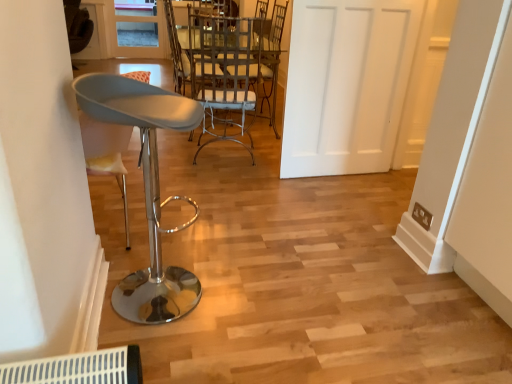
Locate an element on the screen. The image size is (512, 384). white matte door at center is located at coordinates (346, 84).

Locate an element on the screen. Image resolution: width=512 pixels, height=384 pixels. white matte door at center is located at coordinates (346, 84).

Between point (400, 114) and point (139, 317), which one is positioned in front?

The point (139, 317) is closer.

Is white matte door at center oriented away from matte gray stool at left, marked as the 2th chair in a back-to-front arrangement?

white matte door at center does not have its back to matte gray stool at left, marked as the 2th chair in a back-to-front arrangement.

Considering the relative positions of white matte door at center and matte gray stool at left, which appears as the first chair when viewed from the front, in the image provided, is white matte door at center to the left or to the right of matte gray stool at left, which appears as the first chair when viewed from the front,?

In the image, white matte door at center appears on the right side of matte gray stool at left, which appears as the first chair when viewed from the front.

Which object is more forward, white matte door at center or matte gray stool at left, marked as the 2th chair in a back-to-front arrangement?

Positioned in front is matte gray stool at left, marked as the 2th chair in a back-to-front arrangement.

I want to click on door in front of the clear glass door at upper center, so click(346, 84).

Consider the image. Considering the sizes of objects clear glass door at upper center and white matte door at center in the image provided, who is wider, clear glass door at upper center or white matte door at center?

white matte door at center.

Considering the relative positions of clear glass door at upper center and white matte door at center in the image provided, is clear glass door at upper center to the left of white matte door at center from the viewer's perspective?

Indeed, clear glass door at upper center is positioned on the left side of white matte door at center.

Based on the photo, does clear glass door at upper center have a lesser height compared to white matte door at center?

Correct, clear glass door at upper center is not as tall as white matte door at center.

From a real-world perspective, who is located higher, white fabric chair at center, the second chair from the front, or clear glass door at upper center?

From a 3D spatial view, white fabric chair at center, the second chair from the front, is above.

Can you tell me how much white fabric chair at center, the second chair from the front, and clear glass door at upper center differ in facing direction?

The facing directions of white fabric chair at center, the second chair from the front, and clear glass door at upper center are 104 degrees apart.

Is white fabric chair at center, the second chair from the front, facing away from clear glass door at upper center?

Answer: No.

Which point is more forward, (205, 40) or (130, 27)?

The point (205, 40) is in front.

From the image's perspective, is white fabric chair at center, which is the 1th chair in back-to-front order, over matte gray stool at left, which appears as the first chair when viewed from the front?

Indeed, from the image's perspective, white fabric chair at center, which is the 1th chair in back-to-front order, is shown above matte gray stool at left, which appears as the first chair when viewed from the front.

Is white fabric chair at center, which is the 1th chair in back-to-front order, taller or shorter than matte gray stool at left, marked as the 2th chair in a back-to-front arrangement?

Clearly, white fabric chair at center, which is the 1th chair in back-to-front order, is taller compared to matte gray stool at left, marked as the 2th chair in a back-to-front arrangement.

Is matte gray stool at left, marked as the 2th chair in a back-to-front arrangement, a part of white fabric chair at center, the second chair from the front?

Actually, matte gray stool at left, marked as the 2th chair in a back-to-front arrangement, is outside white fabric chair at center, the second chair from the front.

Considering the sizes of objects white fabric chair at center, the second chair from the front, and matte gray stool at left, marked as the 2th chair in a back-to-front arrangement, in the image provided, who is thinner, white fabric chair at center, the second chair from the front, or matte gray stool at left, marked as the 2th chair in a back-to-front arrangement,?

matte gray stool at left, marked as the 2th chair in a back-to-front arrangement, is thinner.

From a real-world perspective, is matte gray stool at left, which appears as the first chair when viewed from the front, under clear glass door at upper center?

Actually, matte gray stool at left, which appears as the first chair when viewed from the front, is physically above clear glass door at upper center in the real world.

Which of these two, matte gray stool at left, which appears as the first chair when viewed from the front, or clear glass door at upper center, is thinner?

clear glass door at upper center.

Is matte gray stool at left, which appears as the first chair when viewed from the front, inside or outside of clear glass door at upper center?

matte gray stool at left, which appears as the first chair when viewed from the front, lies outside clear glass door at upper center.

Is matte gray stool at left, marked as the 2th chair in a back-to-front arrangement, positioned with its back to clear glass door at upper center?

No.

From the image's perspective, does matte gray stool at left, marked as the 2th chair in a back-to-front arrangement, appear higher than white matte door at center?

No, from the image's perspective, matte gray stool at left, marked as the 2th chair in a back-to-front arrangement, is not on top of white matte door at center.

Between matte gray stool at left, marked as the 2th chair in a back-to-front arrangement, and white matte door at center, which one appears on the left side from the viewer's perspective?

matte gray stool at left, marked as the 2th chair in a back-to-front arrangement.

How distant is matte gray stool at left, marked as the 2th chair in a back-to-front arrangement, from white matte door at center?

The distance of matte gray stool at left, marked as the 2th chair in a back-to-front arrangement, from white matte door at center is 4.17 feet.

Could you tell me if matte gray stool at left, marked as the 2th chair in a back-to-front arrangement, is turned towards white matte door at center?

No, matte gray stool at left, marked as the 2th chair in a back-to-front arrangement, is not facing towards white matte door at center.

Is white matte door at center directly adjacent to clear glass door at upper center?

No.

What's the angular difference between white matte door at center and clear glass door at upper center's facing directions?

The facing directions of white matte door at center and clear glass door at upper center are 0.411 degrees apart.

Which point is more distant from viewer, (x=325, y=168) or (x=126, y=45)?

The point (x=126, y=45) is farther from the camera.

At what (x,y) coordinates should I click in order to perform the action: click on the 2nd chair counting from the left side of the white matte door at center. Please return your answer as a coordinate pair (x, y). This screenshot has width=512, height=384. Looking at the image, I should click on (147, 189).

Identify the location of window that appears behind the white matte door at center. (138, 29).

In the scene shown: Estimate the real-world distances between objects in this image. Which object is further from white fabric chair at center, which is the 1th chair in back-to-front order, clear glass door at upper center or white matte door at center?

clear glass door at upper center.

When comparing their distances from white fabric chair at center, which is the 1th chair in back-to-front order, does matte gray stool at left, which appears as the first chair when viewed from the front, or clear glass door at upper center seem closer?

clear glass door at upper center is closer to white fabric chair at center, which is the 1th chair in back-to-front order.

Considering their positions, is clear glass door at upper center positioned closer to white matte door at center than matte gray stool at left, which appears as the first chair when viewed from the front?

Based on the image, matte gray stool at left, which appears as the first chair when viewed from the front, appears to be nearer to white matte door at center.

Based on the photo, based on their spatial positions, is white matte door at center or white fabric chair at center, the second chair from the front, closer to matte gray stool at left, marked as the 2th chair in a back-to-front arrangement?

Based on the image, white matte door at center appears to be nearer to matte gray stool at left, marked as the 2th chair in a back-to-front arrangement.

From the picture: Based on their spatial positions, is white matte door at center or clear glass door at upper center closer to white fabric chair at center, which is the 1th chair in back-to-front order?

white matte door at center is positioned closer to the anchor white fabric chair at center, which is the 1th chair in back-to-front order.

Estimate the real-world distances between objects in this image. Which object is closer to white matte door at center, matte gray stool at left, marked as the 2th chair in a back-to-front arrangement, or white fabric chair at center, which is the 1th chair in back-to-front order?

white fabric chair at center, which is the 1th chair in back-to-front order, is closer to white matte door at center.

Estimate the real-world distances between objects in this image. Which object is closer to matte gray stool at left, marked as the 2th chair in a back-to-front arrangement, clear glass door at upper center or white fabric chair at center, the second chair from the front?

white fabric chair at center, the second chair from the front, is closer to matte gray stool at left, marked as the 2th chair in a back-to-front arrangement.

Which object lies nearer to the anchor point clear glass door at upper center, white fabric chair at center, which is the 1th chair in back-to-front order, or white matte door at center?

white fabric chair at center, which is the 1th chair in back-to-front order.

Find the location of a particular element. The width and height of the screenshot is (512, 384). door between matte gray stool at left, marked as the 2th chair in a back-to-front arrangement, and white fabric chair at center, which is the 1th chair in back-to-front order, from front to back is located at coordinates (346, 84).

Where is `chair between matte gray stool at left, which appears as the first chair when viewed from the front, and clear glass door at upper center, along the z-axis`? Image resolution: width=512 pixels, height=384 pixels. chair between matte gray stool at left, which appears as the first chair when viewed from the front, and clear glass door at upper center, along the z-axis is located at coordinates (267, 59).

Locate an element on the screen. chair positioned between white matte door at center and clear glass door at upper center from near to far is located at coordinates (267, 59).

The height and width of the screenshot is (384, 512). I want to click on door positioned between matte gray stool at left, marked as the 2th chair in a back-to-front arrangement, and clear glass door at upper center from near to far, so click(x=346, y=84).